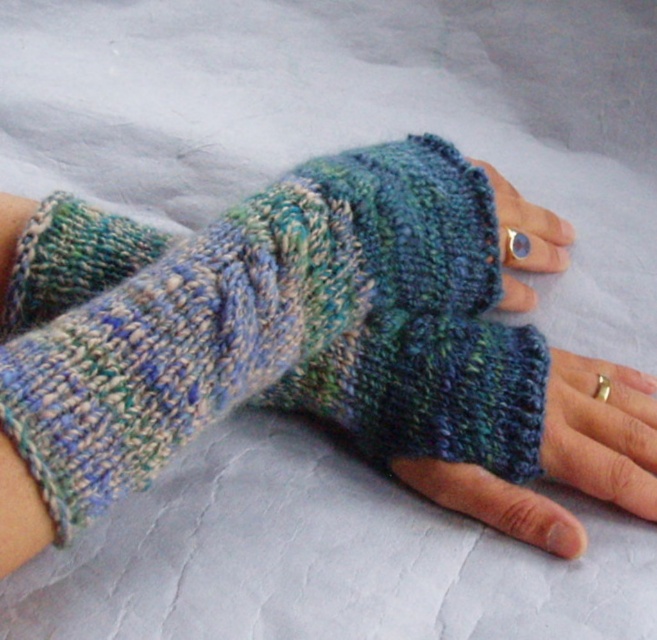
You are a photographer trying to capture the multicolored knitted fingerless gloves at center. The camera is positioned at point 0.506, 0.403. Will the gloves be in focus if the camera is focused at point 0.506, 0.403?

The multicolored knitted fingerless gloves at center are positioned at point [263,323], so focusing the camera at that point will ensure the gloves are in focus.

You are a tailor trying to determine which of the two items at the center of the image is taller. You have the multicolored knitted fingerless gloves at center and the knitted wool fingerless glove at center. Which one is taller?

The multicolored knitted fingerless gloves at center is taller than the knitted wool fingerless glove at center according to the description.